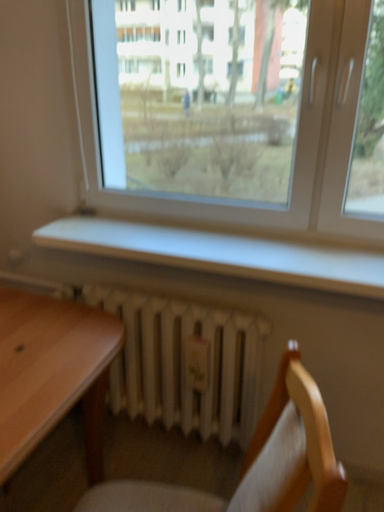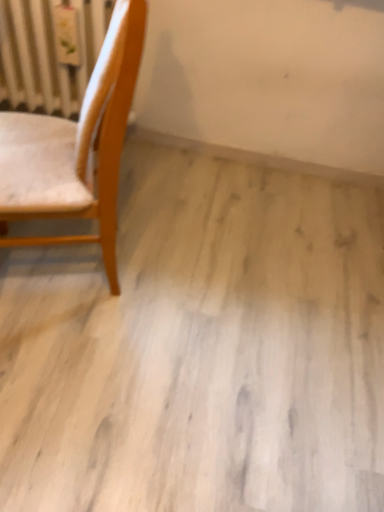
Question: How did the camera likely rotate when shooting the video?

Choices:
 (A) rotated right
 (B) rotated left

Answer: (A)